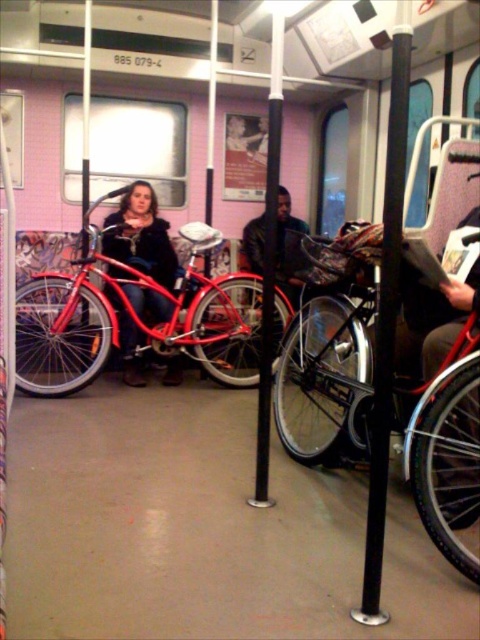
You are a passenger on a train and need to place your matte black jacket at center on the shiny red bicycle at left. Is the jacket large enough to cover the entire bicycle?

The shiny red bicycle at left has a larger size compared to matte black jacket at center, so the jacket is not large enough to cover the entire bicycle.

You are a passenger on this vehicle and want to place your matte black jacket at center on the shiny red bicycle at left. Will the jacket fit on the bicycle?

The shiny red bicycle at left is wider than the matte black jacket at center, so the jacket will fit on the bicycle.